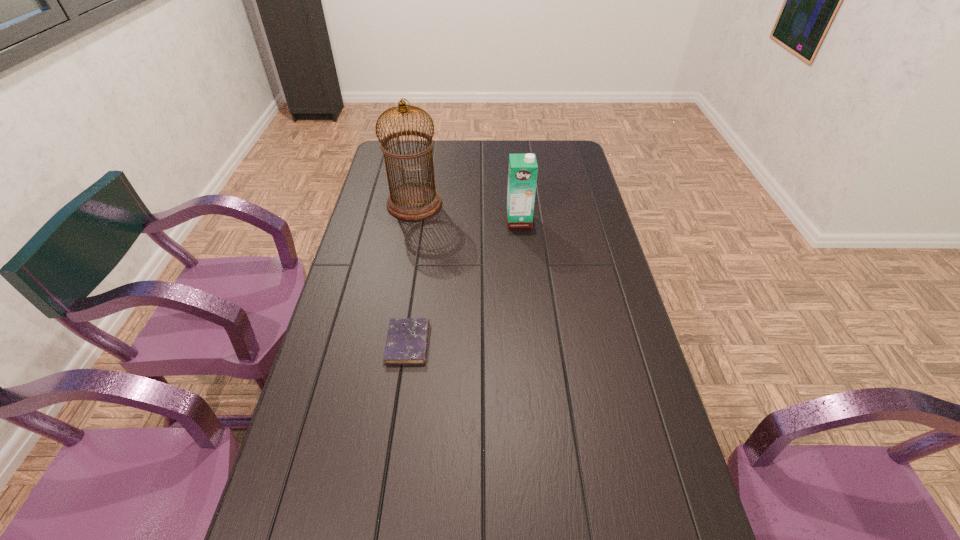
Find the location of a particular element. Image resolution: width=960 pixels, height=540 pixels. free area in between the tallest object and the nearest object is located at coordinates (411, 273).

Where is `empty space between the rightmost object and the diary`? This screenshot has width=960, height=540. empty space between the rightmost object and the diary is located at coordinates (464, 282).

Point out which object is positioned as the nearest to the birdcage. Please provide its 2D coordinates. Your answer should be formatted as a tuple, i.e. [(x, y)], where the tuple contains the x and y coordinates of a point satisfying the conditions above.

[(522, 173)]

Point out which object is positioned as the second nearest to the second tallest object. Please provide its 2D coordinates. Your answer should be formatted as a tuple, i.e. [(x, y)], where the tuple contains the x and y coordinates of a point satisfying the conditions above.

[(407, 338)]

Identify the location of vacant point that satisfies the following two spatial constraints: 1. on the front-facing side of the second shortest object; 2. on the left side of the birdcage. This screenshot has height=540, width=960. (411, 220).

Identify the location of free space that satisfies the following two spatial constraints: 1. on the front-facing side of the birdcage; 2. on the right side of the carton. The height and width of the screenshot is (540, 960). (411, 220).

Identify the location of free spot that satisfies the following two spatial constraints: 1. on the back side of the nearest object; 2. on the right side of the carton. This screenshot has height=540, width=960. (425, 220).

This screenshot has width=960, height=540. Identify the location of vacant space that satisfies the following two spatial constraints: 1. on the back side of the shortest object; 2. on the front-facing side of the birdcage. (428, 204).

This screenshot has width=960, height=540. I want to click on free location that satisfies the following two spatial constraints: 1. on the front-facing side of the tallest object; 2. on the back side of the diary, so click(390, 343).

The image size is (960, 540). What are the coordinates of `blank area in the image that satisfies the following two spatial constraints: 1. on the back side of the nearest object; 2. on the front-facing side of the birdcage` in the screenshot? It's located at (428, 204).